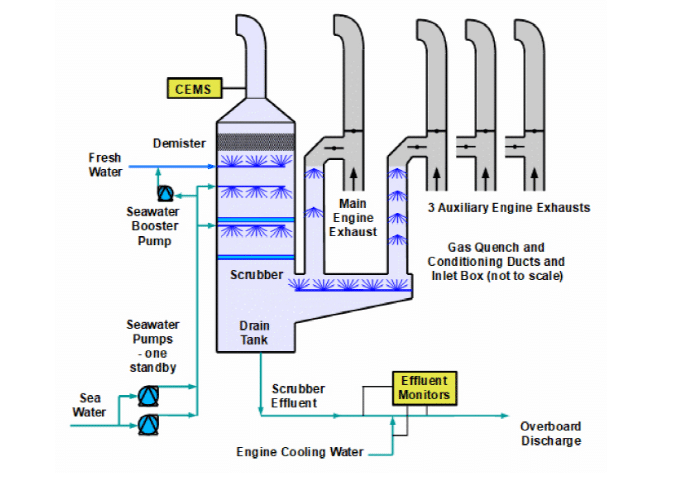
The image size is (688, 484). Find the location of `cover`. cover is located at coordinates (261, 113).